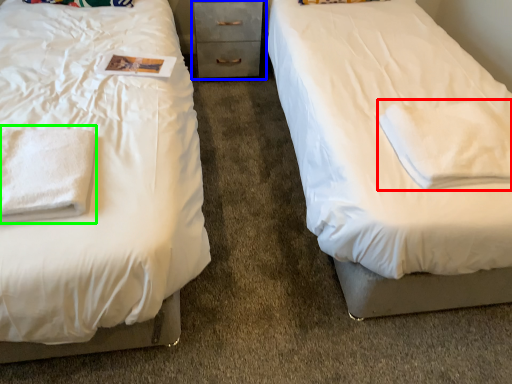
Question: Which object is the closest to the cloth (highlighted by a red box)? Choose among these: chest of drawers (highlighted by a blue box) or cloth (highlighted by a green box).

Choices:
 (A) chest of drawers
 (B) cloth

Answer: (B)